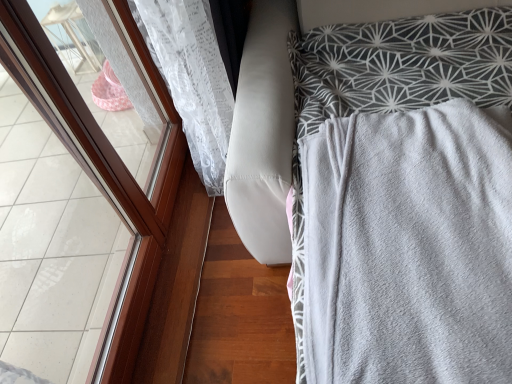
The image size is (512, 384). Describe the element at coordinates (112, 77) in the screenshot. I see `brown wooden frame at left` at that location.

Where is `brown wooden frame at left`? This screenshot has width=512, height=384. brown wooden frame at left is located at coordinates (112, 77).

This screenshot has height=384, width=512. What do you see at coordinates (395, 190) in the screenshot? I see `gray soft blanket at right` at bounding box center [395, 190].

Find the location of a particular element. The width and height of the screenshot is (512, 384). gray soft blanket at right is located at coordinates (395, 190).

The height and width of the screenshot is (384, 512). I want to click on brown wooden frame at left, so click(x=112, y=77).

In the scene shown: Is gray soft blanket at right at the left side of brown wooden frame at left?

No.

Considering the relative positions of gray soft blanket at right and brown wooden frame at left in the image provided, is gray soft blanket at right behind brown wooden frame at left?

No, it is in front of brown wooden frame at left.

Which is closer to the camera, (282, 206) or (152, 110)?

The point (282, 206) is closer to the camera.

From the image's perspective, is gray soft blanket at right above brown wooden frame at left?

No.

From a real-world perspective, which object stands above the other?

brown wooden frame at left.

Between gray soft blanket at right and brown wooden frame at left, which one has smaller width?

brown wooden frame at left.

Considering the sizes of objects gray soft blanket at right and brown wooden frame at left in the image provided, who is taller, gray soft blanket at right or brown wooden frame at left?

brown wooden frame at left is taller.

Considering the sizes of objects gray soft blanket at right and brown wooden frame at left in the image provided, who is smaller, gray soft blanket at right or brown wooden frame at left?

brown wooden frame at left is smaller.

Which is correct: gray soft blanket at right is inside brown wooden frame at left, or outside of it?

gray soft blanket at right is outside brown wooden frame at left.

Is gray soft blanket at right placed right next to brown wooden frame at left?

No, gray soft blanket at right is not in contact with brown wooden frame at left.

Could you tell me if gray soft blanket at right is turned towards brown wooden frame at left?

No, gray soft blanket at right does not turn towards brown wooden frame at left.

Measure the distance from gray soft blanket at right to brown wooden frame at left.

gray soft blanket at right is 31.77 inches from brown wooden frame at left.

Where is `window that is above the gray soft blanket at right (from the image's perspective)`? Image resolution: width=512 pixels, height=384 pixels. window that is above the gray soft blanket at right (from the image's perspective) is located at coordinates (112, 77).

Can you confirm if brown wooden frame at left is positioned to the left of gray soft blanket at right?

Indeed, brown wooden frame at left is positioned on the left side of gray soft blanket at right.

Does brown wooden frame at left come behind gray soft blanket at right?

Yes, brown wooden frame at left is further from the camera.

Is point (110, 37) closer or farther from the camera than point (365, 132)?

Point (110, 37).

From the image's perspective, is brown wooden frame at left located above or below gray soft blanket at right?

From the image's perspective, brown wooden frame at left appears above gray soft blanket at right.

From a real-world perspective, is brown wooden frame at left physically above gray soft blanket at right?

Indeed, from a real-world perspective, brown wooden frame at left stands above gray soft blanket at right.

Is brown wooden frame at left thinner than gray soft blanket at right?

Yes.

Between brown wooden frame at left and gray soft blanket at right, which one has more height?

brown wooden frame at left is taller.

Consider the image. Looking at the image, does brown wooden frame at left seem bigger or smaller compared to gray soft blanket at right?

Considering their sizes, brown wooden frame at left takes up less space than gray soft blanket at right.

Which is correct: brown wooden frame at left is inside gray soft blanket at right, or outside of it?

brown wooden frame at left is outside gray soft blanket at right.

Is brown wooden frame at left not near gray soft blanket at right?

That's not correct — brown wooden frame at left is a little close to gray soft blanket at right.

Is brown wooden frame at left facing away from gray soft blanket at right?

No, brown wooden frame at left is not facing the opposite direction of gray soft blanket at right.

How much distance is there between brown wooden frame at left and gray soft blanket at right?

31.77 inches.

At what (x,y) coordinates should I click in order to perform the action: click on furniture on the right of brown wooden frame at left. Please return your answer as a coordinate pair (x, y). The height and width of the screenshot is (384, 512). Looking at the image, I should click on (395, 190).

Where is `furniture on the right of brown wooden frame at left`? furniture on the right of brown wooden frame at left is located at coordinates (395, 190).

This screenshot has width=512, height=384. In order to click on window behind the gray soft blanket at right in this screenshot , I will do `click(112, 77)`.